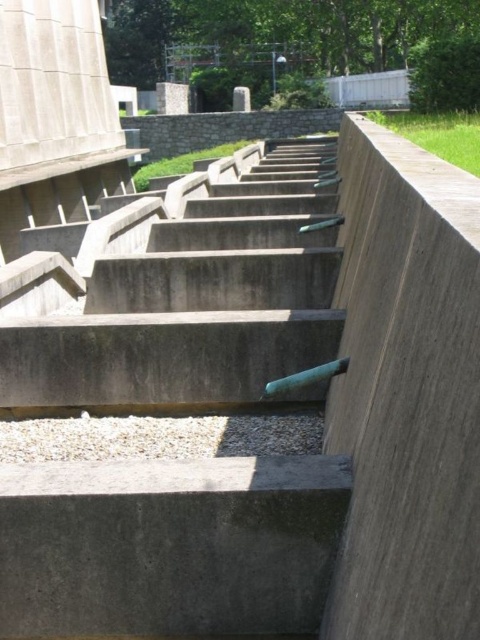
Question: Is concrete stairs at center to the left of gray concrete at center from the viewer's perspective?

Choices:
 (A) yes
 (B) no

Answer: (A)

Question: Can you confirm if concrete stairs at center is positioned below gray concrete at center?

Choices:
 (A) yes
 (B) no

Answer: (B)

Question: Among these points, which one is farthest from the camera?

Choices:
 (A) (315, 536)
 (B) (299, 337)

Answer: (B)

Question: Which point is closer to the camera?

Choices:
 (A) gray concrete at center
 (B) concrete stairs at center

Answer: (A)

Question: Which of the following is the farthest from the observer?

Choices:
 (A) gray concrete at center
 (B) concrete stairs at center

Answer: (B)

Question: Can you confirm if concrete stairs at center is positioned to the right of gray concrete at center?

Choices:
 (A) yes
 (B) no

Answer: (B)